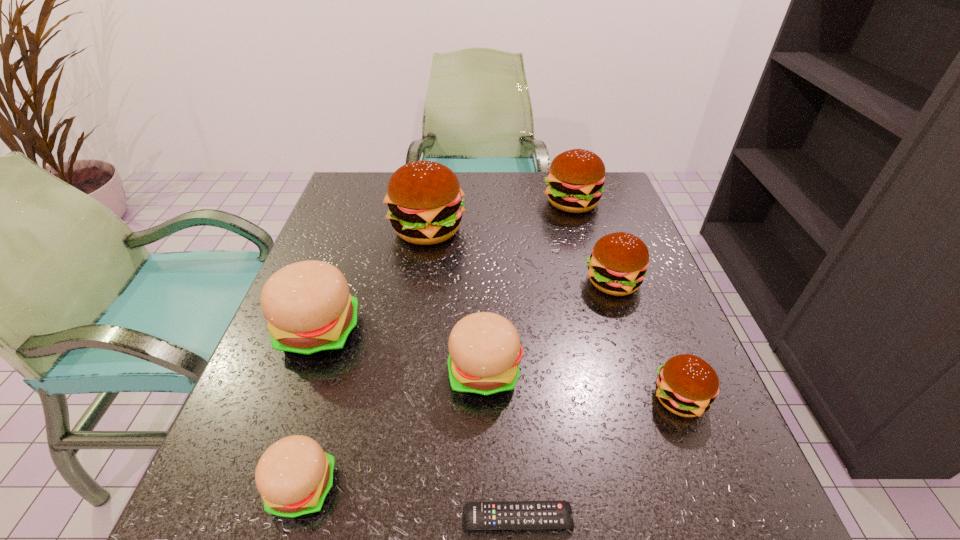
Locate which brown hamburger is the closest to the rightmost beige hamburger. Please provide its 2D coordinates. Your answer should be formatted as a tuple, i.e. [(x, y)], where the tuple contains the x and y coordinates of a point satisfying the conditions above.

[(618, 263)]

Choose which brown hamburger is the fourth nearest neighbor to the smallest beige hamburger. Please provide its 2D coordinates. Your answer should be formatted as a tuple, i.e. [(x, y)], where the tuple contains the x and y coordinates of a point satisfying the conditions above.

[(575, 181)]

Point out which beige hamburger is positioned as the third nearest to the smallest brown hamburger. Please provide its 2D coordinates. Your answer should be formatted as a tuple, i.e. [(x, y)], where the tuple contains the x and y coordinates of a point satisfying the conditions above.

[(310, 312)]

Locate which beige hamburger ranks second in proximity to the third smallest brown hamburger. Please provide its 2D coordinates. Your answer should be formatted as a tuple, i.e. [(x, y)], where the tuple contains the x and y coordinates of a point satisfying the conditions above.

[(310, 312)]

Identify the location of vacant space that satisfies the following two spatial constraints: 1. on the front side of the remote control; 2. on the left side of the tallest object. The height and width of the screenshot is (540, 960). (384, 518).

Image resolution: width=960 pixels, height=540 pixels. I want to click on blank area in the image that satisfies the following two spatial constraints: 1. on the front side of the biggest beige hamburger; 2. on the right side of the shortest object, so click(252, 518).

Identify the location of vacant space that satisfies the following two spatial constraints: 1. on the back side of the biggest beige hamburger; 2. on the right side of the biggest brown hamburger. (354, 230).

Identify the location of free space that satisfies the following two spatial constraints: 1. on the front side of the third farthest brown hamburger; 2. on the left side of the third smallest brown hamburger. (594, 282).

Locate an element on the screen. free space that satisfies the following two spatial constraints: 1. on the back side of the fifth nearest hamburger; 2. on the right side of the biggest beige hamburger is located at coordinates (336, 282).